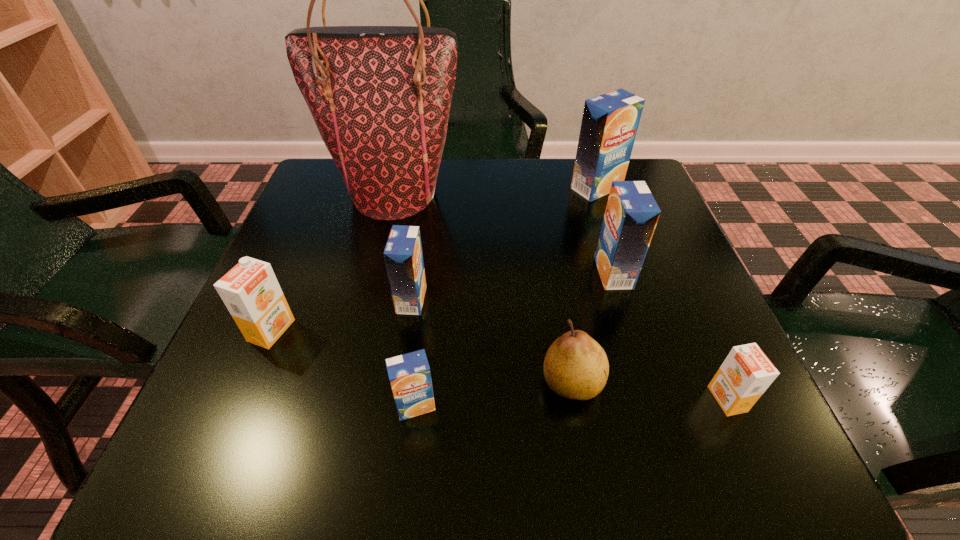
You are a GUI agent. You are given a task and a screenshot of the screen. Output one action in this format:
    pyautogui.click(x=<x>, y=<y>)
    Task: Click on the vacant space that is in between the third smallest blue orange_juice and the handbag
    This screenshot has width=960, height=540.
    Given the screenshot: What is the action you would take?
    pyautogui.click(x=504, y=233)

Locate an element on the screen. object identified as the sixth closest to the brown pear is located at coordinates (250, 290).

Image resolution: width=960 pixels, height=540 pixels. I want to click on object that is the fourth closest one to the right orange orange juice, so click(403, 255).

Identify the location of orange juice that is the closest to the smallest blue orange_juice. (403, 255).

You are a GUI agent. You are given a task and a screenshot of the screen. Output one action in this format:
    pyautogui.click(x=<x>, y=<y>)
    Task: Click on the second closest orange juice relative to the smallest blue orange_juice
    Image resolution: width=960 pixels, height=540 pixels.
    Given the screenshot: What is the action you would take?
    pyautogui.click(x=250, y=290)

What are the coordinates of `blue orange_juice that stands as the third closest to the farthest orange juice` in the screenshot? It's located at (409, 374).

Locate which blue orange_juice ranks in proximity to the nearest blue orange_juice. Please provide its 2D coordinates. Your answer should be formatted as a tuple, i.e. [(x, y)], where the tuple contains the x and y coordinates of a point satisfying the conditions above.

[(403, 255)]

Locate an element on the screen. free location that satisfies the following two spatial constraints: 1. on the front side of the tallest object; 2. on the left side of the third biggest blue orange_juice is located at coordinates (370, 300).

Identify the location of free region that satisfies the following two spatial constraints: 1. on the back side of the farthest orange juice; 2. on the left side of the smallest blue orange_juice. (440, 188).

Find the location of a particular element. Image resolution: width=960 pixels, height=540 pixels. vacant space that satisfies the following two spatial constraints: 1. on the front side of the handbag; 2. on the left side of the fifth object from left to right is located at coordinates (350, 382).